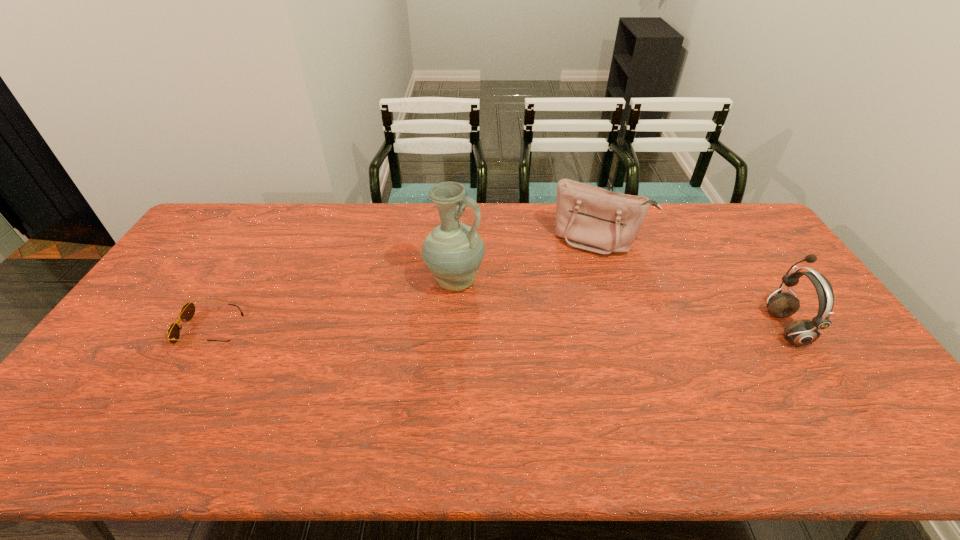
The width and height of the screenshot is (960, 540). I want to click on free space between the rightmost object and the third object from right to left, so click(x=619, y=305).

Locate an element on the screen. free space between the second object from left to right and the second object from right to left is located at coordinates (526, 261).

The height and width of the screenshot is (540, 960). In order to click on empty space that is in between the farthest object and the rightmost object in this screenshot , I will do `click(691, 284)`.

Locate an element on the screen. The image size is (960, 540). object that is the second closest to the second object from right to left is located at coordinates [x=803, y=332].

Identify which object is located as the third nearest to the sunglasses. Please provide its 2D coordinates. Your answer should be formatted as a tuple, i.e. [(x, y)], where the tuple contains the x and y coordinates of a point satisfying the conditions above.

[(803, 332)]

Locate an element on the screen. free location that satisfies the following two spatial constraints: 1. on the front side of the shoulder bag; 2. on the ear pads of the rightmost object is located at coordinates click(625, 327).

The height and width of the screenshot is (540, 960). Identify the location of free space in the image that satisfies the following two spatial constraints: 1. on the front side of the tallest object; 2. on the ear pads of the rightmost object. (452, 327).